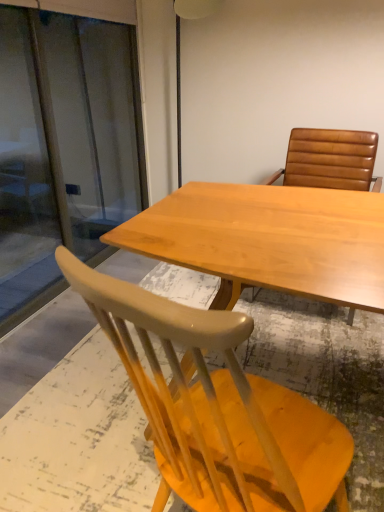
Question: From a real-world perspective, is brown leather chair at upper right, the second chair from the bottom, physically located above or below light wood table at center?

Choices:
 (A) below
 (B) above

Answer: (B)

Question: Would you say brown leather chair at upper right, acting as the 1th chair starting from the top, is to the left or to the right of light wood table at center in the picture?

Choices:
 (A) left
 (B) right

Answer: (B)

Question: Which object is positioned closest to the brown leather chair at upper right, the second chair from the bottom?

Choices:
 (A) light wood table at center
 (B) matte yellow chair at lower left, the 2th chair when ordered from top to bottom
 (C) transparent glass screen door at left

Answer: (A)

Question: Which is nearer to the brown leather chair at upper right, acting as the 1th chair starting from the top?

Choices:
 (A) transparent glass screen door at left
 (B) light wood table at center
 (C) matte yellow chair at lower left, the 2th chair when ordered from top to bottom

Answer: (B)